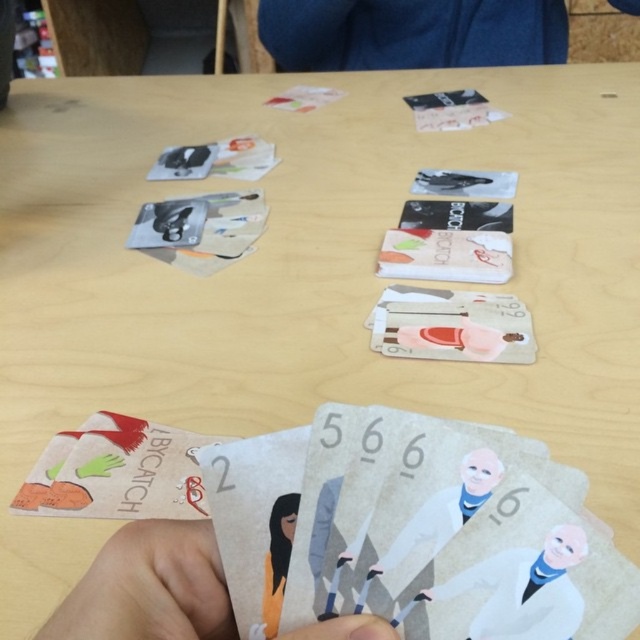
Question: Which object appears closest to the camera in this image?

Choices:
 (A) matte paper card at lower center
 (B) matte cardboard card at lower left
 (C) blue fabric at upper center

Answer: (A)

Question: In this image, where is blue fabric at upper center located relative to matte cardboard card at lower left?

Choices:
 (A) above
 (B) below

Answer: (A)

Question: Is matte cardboard card at lower left to the left of smooth white coat at center from the viewer's perspective?

Choices:
 (A) yes
 (B) no

Answer: (A)

Question: Which point appears farthest from the camera in this image?

Choices:
 (A) (582, 554)
 (B) (116, 548)
 (C) (145, 508)

Answer: (C)

Question: Is smooth white coat at center in front of white paper character at center?

Choices:
 (A) yes
 (B) no

Answer: (A)

Question: Which object is positioned closest to the white paper character at center?

Choices:
 (A) blue fabric at upper center
 (B) matte cardboard card at lower left
 (C) matte paper card at lower center

Answer: (C)